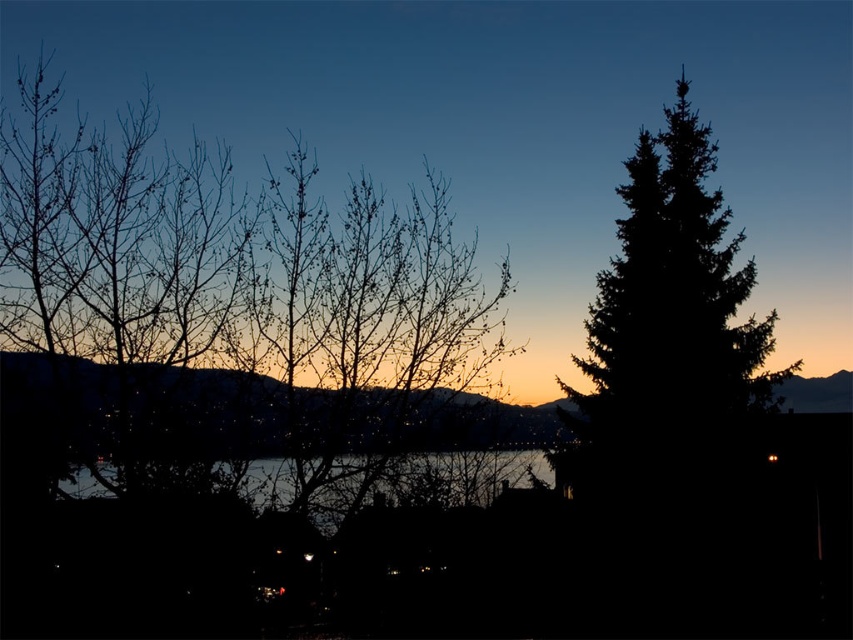
Does dark green textured tree at right appear on the left side of transparent water at center?

In fact, dark green textured tree at right is to the right of transparent water at center.

Between dark green textured tree at right and transparent water at center, which one has less height?

dark green textured tree at right is shorter.

Who is more distant from viewer, [698,440] or [352,468]?

The point [698,440] is behind.

At what (x,y) coordinates should I click in order to perform the action: click on dark green textured tree at right. Please return your answer as a coordinate pair (x, y). The height and width of the screenshot is (640, 853). Looking at the image, I should click on (666, 328).